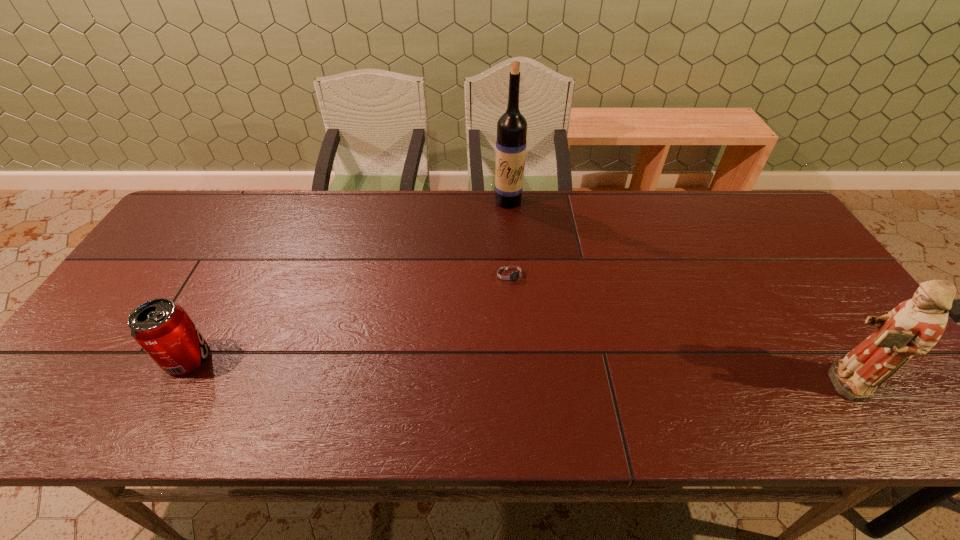
The image size is (960, 540). What are the coordinates of `the leftmost object` in the screenshot? It's located at (162, 328).

The width and height of the screenshot is (960, 540). What are the coordinates of `the third tallest object` in the screenshot? It's located at (162, 328).

The image size is (960, 540). In order to click on the rightmost object in this screenshot , I will do `click(912, 328)`.

Find the location of a particular element. This screenshot has width=960, height=540. figurine is located at coordinates (912, 328).

Locate an element on the screen. the shortest object is located at coordinates pos(509,274).

Identify the location of the third nearest object. The image size is (960, 540). (509, 274).

What are the coordinates of `wine bottle` in the screenshot? It's located at (511, 142).

What are the coordinates of `the farthest object` in the screenshot? It's located at (511, 142).

The width and height of the screenshot is (960, 540). Find the location of `vacant space located 0.150m on the left of the third tallest object`. vacant space located 0.150m on the left of the third tallest object is located at coordinates (102, 359).

This screenshot has width=960, height=540. Find the location of `vacant space situated on the front-facing side of the rightmost object`. vacant space situated on the front-facing side of the rightmost object is located at coordinates (749, 382).